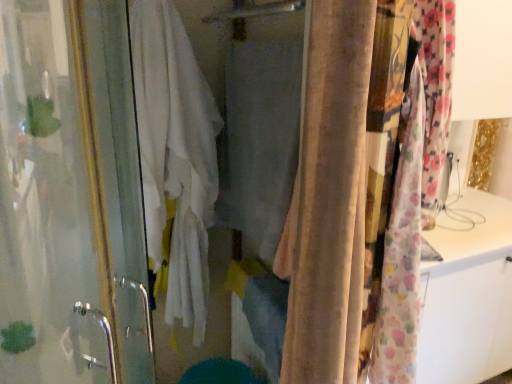
Question: Is fluffy floral fabric at right, acting as the first curtain starting from the right, positioned behind transparent glass screen door at left?

Choices:
 (A) no
 (B) yes

Answer: (B)

Question: From a real-world perspective, is fluffy floral fabric at right, placed as the 2th curtain when sorted from left to right, located beneath transparent glass screen door at left?

Choices:
 (A) no
 (B) yes

Answer: (A)

Question: Is fluffy floral fabric at right, placed as the 2th curtain when sorted from left to right, beside transparent glass screen door at left?

Choices:
 (A) yes
 (B) no

Answer: (B)

Question: Is fluffy floral fabric at right, acting as the first curtain starting from the right, facing towards transparent glass screen door at left?

Choices:
 (A) no
 (B) yes

Answer: (A)

Question: Considering the relative sizes of fluffy floral fabric at right, acting as the first curtain starting from the right, and transparent glass screen door at left in the image provided, is fluffy floral fabric at right, acting as the first curtain starting from the right, bigger than transparent glass screen door at left?

Choices:
 (A) yes
 (B) no

Answer: (B)

Question: From the image's perspective, is fluffy floral fabric at right, acting as the first curtain starting from the right, positioned above or below white cotton bath towel at center?

Choices:
 (A) below
 (B) above

Answer: (A)

Question: From a real-world perspective, is fluffy floral fabric at right, acting as the first curtain starting from the right, above or below white cotton bath towel at center?

Choices:
 (A) above
 (B) below

Answer: (A)

Question: In the image, is fluffy floral fabric at right, placed as the 2th curtain when sorted from left to right, on the left side or the right side of white cotton bath towel at center?

Choices:
 (A) right
 (B) left

Answer: (A)

Question: In terms of size, does fluffy floral fabric at right, acting as the first curtain starting from the right, appear bigger or smaller than white cotton bath towel at center?

Choices:
 (A) big
 (B) small

Answer: (B)

Question: Does point (105, 157) appear closer or farther from the camera than point (401, 148)?

Choices:
 (A) farther
 (B) closer

Answer: (A)

Question: From a real-world perspective, relative to fluffy floral fabric at right, placed as the 2th curtain when sorted from left to right, is transparent glass screen door at left vertically above or below?

Choices:
 (A) below
 (B) above

Answer: (A)

Question: Is transparent glass screen door at left bigger or smaller than fluffy floral fabric at right, acting as the first curtain starting from the right?

Choices:
 (A) big
 (B) small

Answer: (A)

Question: Visually, is transparent glass screen door at left positioned to the left or to the right of fluffy floral fabric at right, acting as the first curtain starting from the right?

Choices:
 (A) right
 (B) left

Answer: (B)

Question: In the image, is fluffy floral fabric at right, placed as the 2th curtain when sorted from left to right, positioned in front of or behind beige velvet curtain at center, the 2th curtain from the right?

Choices:
 (A) behind
 (B) front

Answer: (A)

Question: Is fluffy floral fabric at right, acting as the first curtain starting from the right, inside the boundaries of beige velvet curtain at center, the 1th curtain when ordered from left to right, or outside?

Choices:
 (A) outside
 (B) inside

Answer: (A)